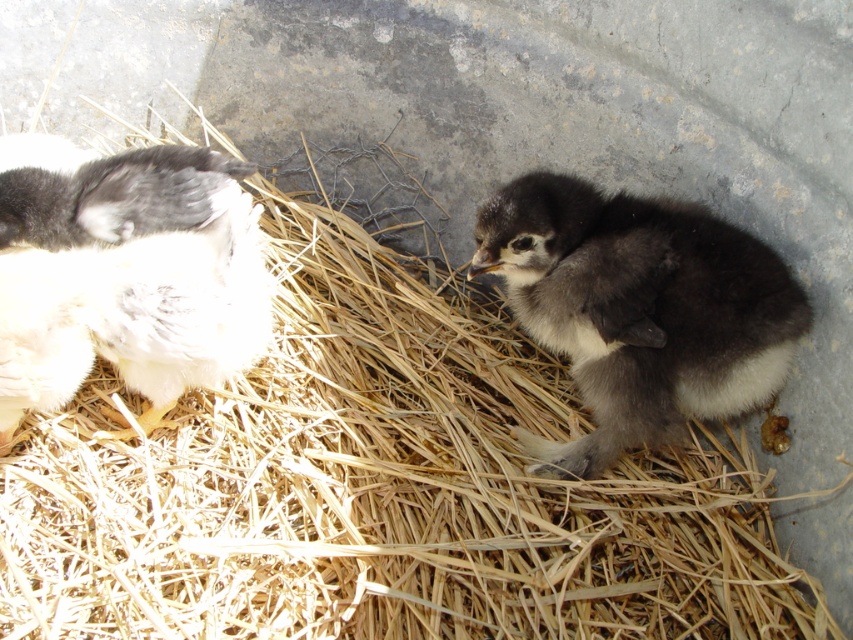
You are standing 4 feet away from the camera. Is the point at coordinates point (82,364) closer to you than the camera?

The distance of point (82,364) from camera is 3.79 feet. Since you are standing 4 feet away from the camera, the point is closer to you than the camera.

You are a farmer checking on the chicks in their straw container. You need to know if the white fluffy chicken at left has more space to move around compared to the dark gray fluffy chick at center. Based on the scene, what can you determine?

The white fluffy chicken at left occupies less space than dark gray fluffy chick at center, so it likely has less room to move around compared to the dark gray fluffy chick at center.